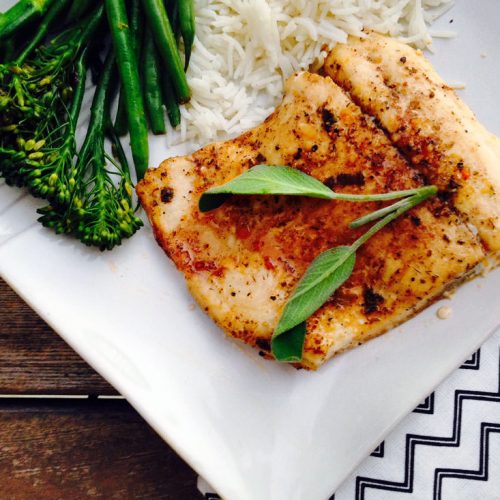
The height and width of the screenshot is (500, 500). Identify the location of white chevron shape on a napkion. (388, 458), (425, 461).